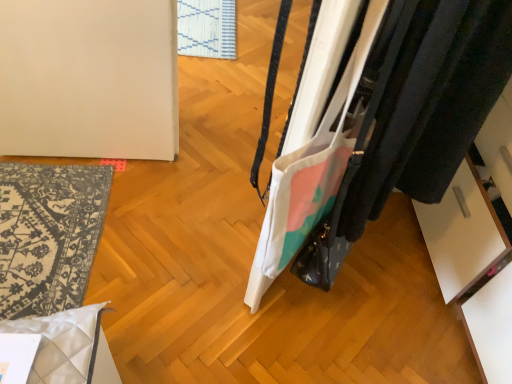
Describe the element at coordinates (433, 104) in the screenshot. I see `white canvas tote bag at right` at that location.

What is the approximate height of white canvas tote bag at right?

The height of white canvas tote bag at right is 28.76 inches.

At what (x,y) coordinates should I click in order to perform the action: click on white canvas tote bag at right. Please return your answer as a coordinate pair (x, y). Image resolution: width=512 pixels, height=384 pixels. Looking at the image, I should click on (433, 104).

Locate an element on the screen. The image size is (512, 384). white canvas tote bag at right is located at coordinates (433, 104).